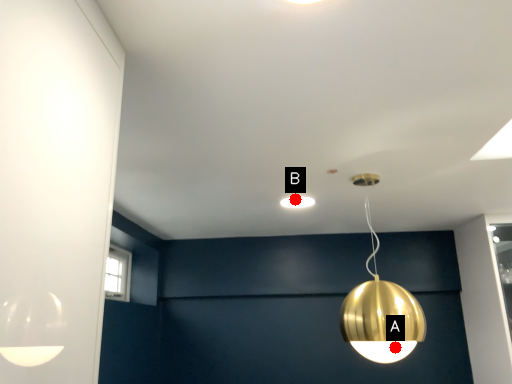
Question: Two points are circled on the image, labeled by A and B beside each circle. Which point is further to the camera?

Choices:
 (A) A is further
 (B) B is further

Answer: (B)